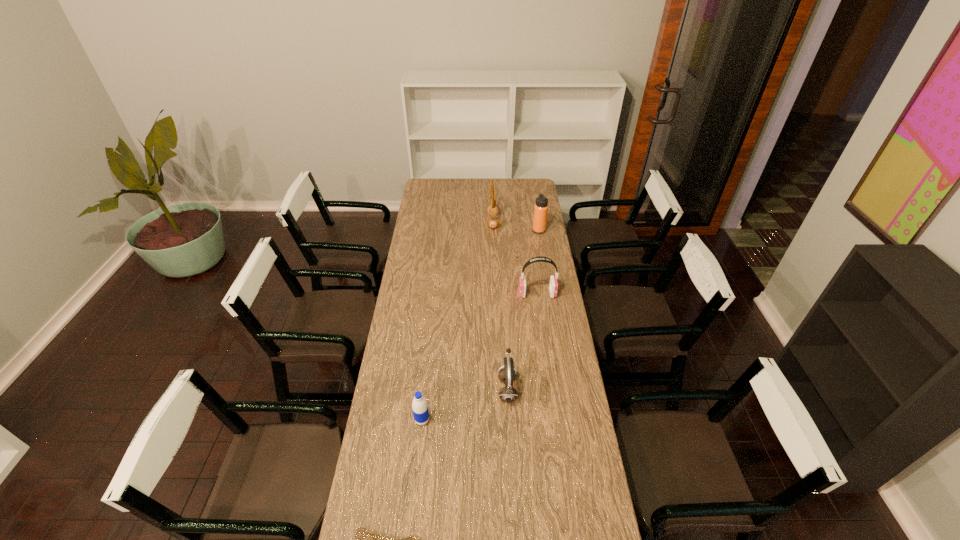
The width and height of the screenshot is (960, 540). I want to click on vacant region between the water bottle and the farthest earphone, so click(458, 321).

Where is `vacant space in between the fifth farthest object and the thermos bottle`? Image resolution: width=960 pixels, height=540 pixels. vacant space in between the fifth farthest object and the thermos bottle is located at coordinates (480, 325).

You are a GUI agent. You are given a task and a screenshot of the screen. Output one action in this format:
    pyautogui.click(x=<x>, y=<y>)
    Task: Click on the empty space that is in between the second nearest earphone and the third nearest object
    Image resolution: width=960 pixels, height=540 pixels.
    Given the screenshot: What is the action you would take?
    pyautogui.click(x=522, y=341)

Locate which object ranks third in proximity to the second farthest earphone. Please provide its 2D coordinates. Your answer should be formatted as a tuple, i.e. [(x, y)], where the tuple contains the x and y coordinates of a point satisfying the conditions above.

[(492, 209)]

Identify which object is the closest to the thermos bottle. Please provide its 2D coordinates. Your answer should be formatted as a tuple, i.e. [(x, y)], where the tuple contains the x and y coordinates of a point satisfying the conditions above.

[(492, 209)]

The height and width of the screenshot is (540, 960). Find the location of `the second closest earphone to the farthest earphone`. the second closest earphone to the farthest earphone is located at coordinates (506, 375).

This screenshot has width=960, height=540. Identify the location of earphone that is the nearest to the second shortest object. (506, 375).

Locate an element on the screen. The image size is (960, 540). free spot that satisfies the following two spatial constraints: 1. on the front side of the thermos bottle; 2. on the ear pads of the third nearest object is located at coordinates (x=565, y=389).

I want to click on free space that satisfies the following two spatial constraints: 1. on the front-facing side of the farthest earphone; 2. on the back side of the thermos bottle, so click(x=493, y=231).

Where is `vacant space that satisfies the following two spatial constraints: 1. on the outer surface of the third farthest object; 2. on the front side of the second nearest object`? The width and height of the screenshot is (960, 540). vacant space that satisfies the following two spatial constraints: 1. on the outer surface of the third farthest object; 2. on the front side of the second nearest object is located at coordinates (555, 420).